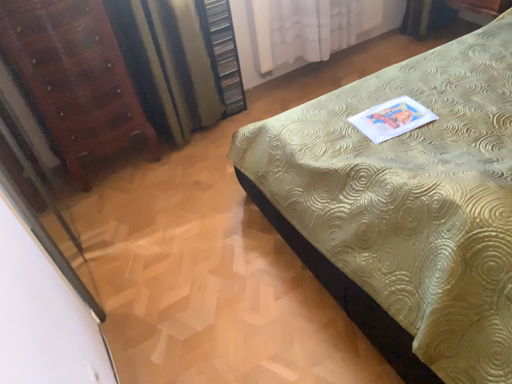
Question: Does point (66, 235) appear closer or farther from the camera than point (82, 56)?

Choices:
 (A) farther
 (B) closer

Answer: (A)

Question: From the image's perspective, is transparent glass screen door at left positioned above or below mahogany wood dresser at left?

Choices:
 (A) below
 (B) above

Answer: (A)

Question: Considering the real-world distances, which object is closest to the gold textured bed at center?

Choices:
 (A) transparent glass screen door at left
 (B) wooden dresser at upper center
 (C) striped fabric curtain at left, positioned as the 2th curtain in right-to-left order
 (D) white sheer curtain at upper center, arranged as the second curtain when viewed from the left
 (E) mahogany wood dresser at left

Answer: (C)

Question: Considering the real-world distances, which object is closest to the mahogany wood dresser at left?

Choices:
 (A) white sheer curtain at upper center, arranged as the second curtain when viewed from the left
 (B) transparent glass screen door at left
 (C) striped fabric curtain at left, positioned as the 2th curtain in right-to-left order
 (D) wooden dresser at upper center
 (E) gold textured bed at center

Answer: (C)